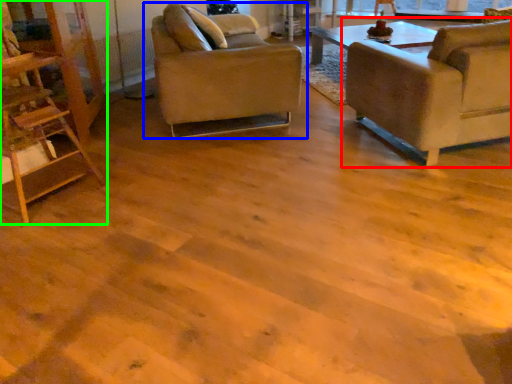
Question: Which is farther away from chair (highlighted by a red box)? chair (highlighted by a blue box) or ladder (highlighted by a green box)?

Choices:
 (A) chair
 (B) ladder

Answer: (B)